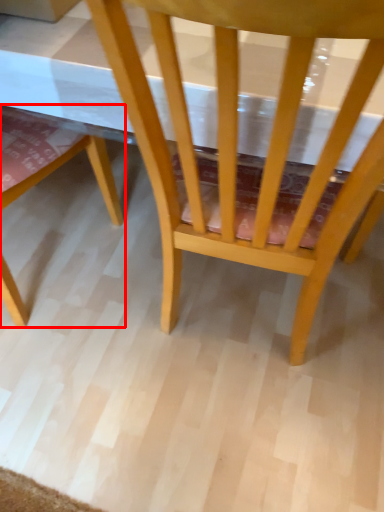
Question: Observing the image, what is the correct spatial positioning of chair (annotated by the red box) in reference to chair?

Choices:
 (A) left
 (B) right

Answer: (A)